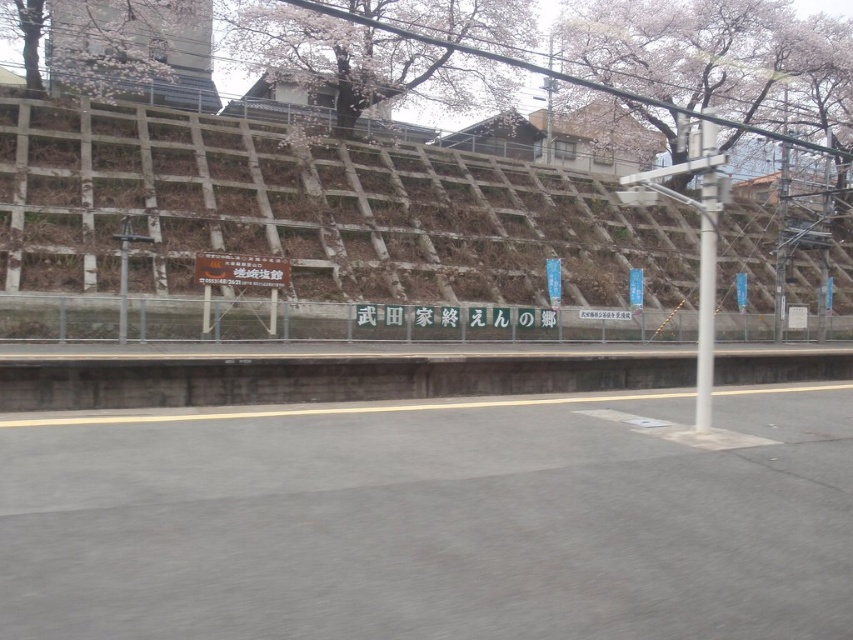
Question: Which point is closer to the camera taking this photo?

Choices:
 (A) (392, 38)
 (B) (757, 86)
 (C) (68, 72)
 (D) (312, 269)

Answer: (D)

Question: Which of the following is the farthest from the observer?

Choices:
 (A) slightly glossy wood at upper left
 (B) cherry blossom tree at upper center

Answer: (A)

Question: Is slightly fuzzy cherry blossom at upper center positioned at the back of white metallic pole at center?

Choices:
 (A) yes
 (B) no

Answer: (A)

Question: Can you confirm if brown textured wall at upper center is positioned below white metallic pole at center?

Choices:
 (A) no
 (B) yes

Answer: (A)

Question: Does slightly fuzzy cherry blossom at upper center have a lesser width compared to slightly glossy wood at upper left?

Choices:
 (A) yes
 (B) no

Answer: (B)

Question: Which of these objects is positioned farthest from the brown textured wall at upper center?

Choices:
 (A) cherry blossom tree at upper center
 (B) white metallic pole at center

Answer: (B)